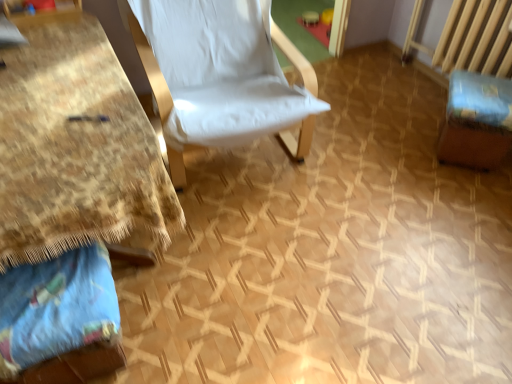
This screenshot has height=384, width=512. What are the coordinates of `vacant space situated above brown fabric swivel chair at right (from a real-world perspective)` in the screenshot? It's located at (486, 89).